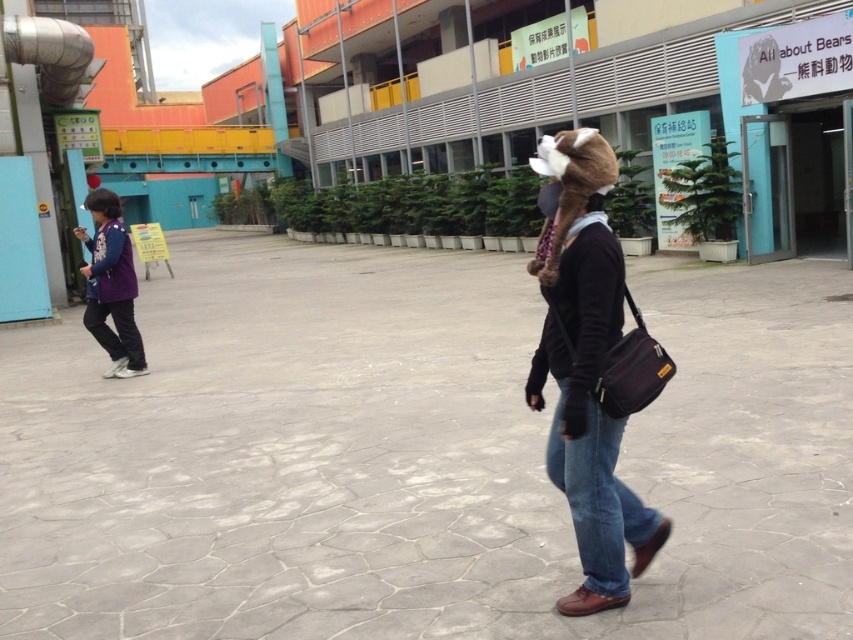
Does brown fur hat at right come in front of denim jeans at lower right?

Yes, brown fur hat at right is in front of denim jeans at lower right.

This screenshot has width=853, height=640. What do you see at coordinates (590, 368) in the screenshot?
I see `brown fur hat at right` at bounding box center [590, 368].

Is point (573, 509) farther from camera compared to point (595, 420)?

Yes, point (573, 509) is behind point (595, 420).

Identify the location of brown fur hat at right. The image size is (853, 640). (590, 368).

Which is below, brown fur hat at right or purple fabric jacket at left?

Positioned lower is brown fur hat at right.

Does brown fur hat at right have a lesser width compared to purple fabric jacket at left?

Incorrect, brown fur hat at right's width is not less than purple fabric jacket at left's.

Is point (637, 368) farther from viewer compared to point (102, 232)?

No, (637, 368) is in front of (102, 232).

You are a GUI agent. You are given a task and a screenshot of the screen. Output one action in this format:
    pyautogui.click(x=<x>, y=<y>)
    Task: Click on the brown fur hat at right
    Image resolution: width=853 pixels, height=640 pixels.
    Given the screenshot: What is the action you would take?
    pyautogui.click(x=590, y=368)

Is denim jeans at lower right shorter than purple fabric jacket at left?

Incorrect, denim jeans at lower right's height does not fall short of purple fabric jacket at left's.

At what (x,y) coordinates should I click in order to perform the action: click on denim jeans at lower right. Please return your answer as a coordinate pair (x, y). The image size is (853, 640). Looking at the image, I should click on (601, 497).